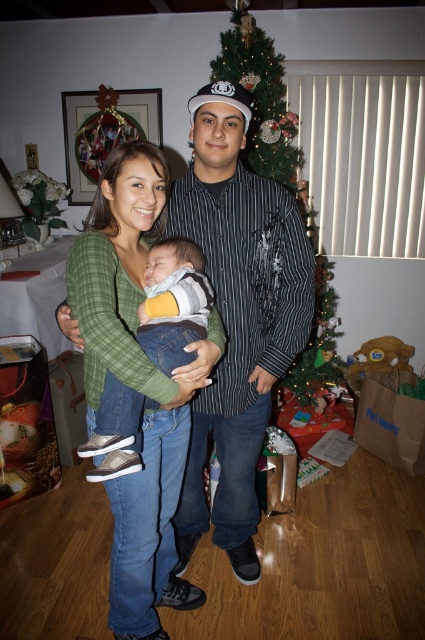
Question: Is green textured christmas tree at center wider than matte gray sneakers at center?

Choices:
 (A) yes
 (B) no

Answer: (A)

Question: Which object is farther from the camera taking this photo?

Choices:
 (A) green textured christmas tree at center
 (B) matte gray sneakers at center
 (C) matte black shirt at center

Answer: (A)

Question: Which point is farther to the camera?

Choices:
 (A) green textured christmas tree at center
 (B) matte gray sneakers at center
 (C) matte black shirt at center

Answer: (A)

Question: Which object is positioned closest to the matte black shirt at center?

Choices:
 (A) green textured christmas tree at center
 (B) matte gray sneakers at center

Answer: (B)

Question: Is green textured christmas tree at center to the left of matte gray sneakers at center from the viewer's perspective?

Choices:
 (A) no
 (B) yes

Answer: (A)

Question: Is green textured christmas tree at center behind matte gray sneakers at center?

Choices:
 (A) yes
 (B) no

Answer: (A)